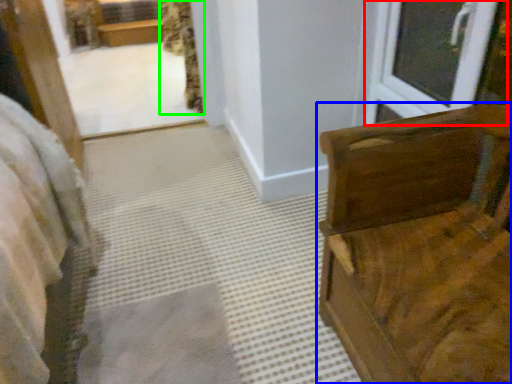
Question: Which object is the farthest from window (highlighted by a red box)? Choose among these: furniture (highlighted by a blue box) or curtain (highlighted by a green box).

Choices:
 (A) furniture
 (B) curtain

Answer: (B)